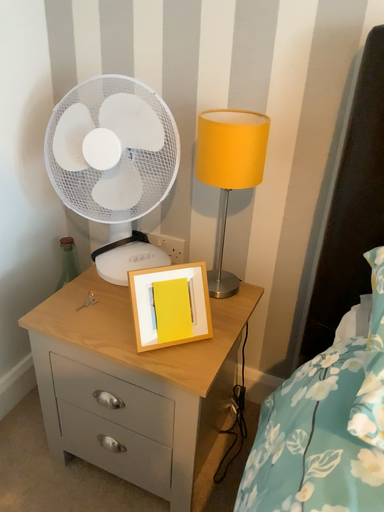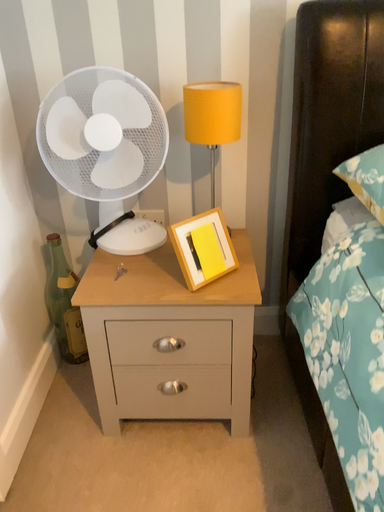
Question: How did the camera likely rotate when shooting the video?

Choices:
 (A) rotated right
 (B) rotated left

Answer: (A)